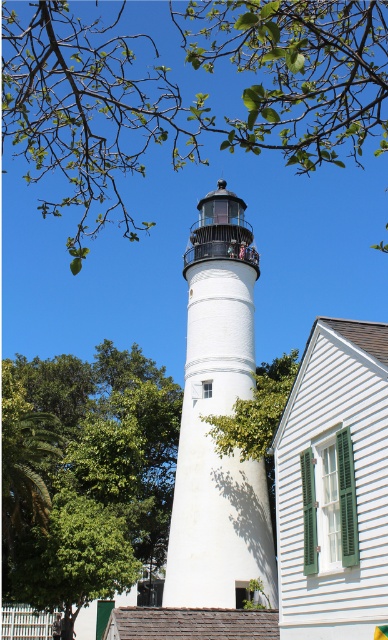
Is green leafy tree at upper center smaller than white matte/lightweight tower at center?

Incorrect, green leafy tree at upper center is not smaller in size than white matte/lightweight tower at center.

Measure the distance between point (136,84) and camera.

Point (136,84) and camera are 120.32 meters apart from each other.

Locate an element on the screen. The width and height of the screenshot is (388, 640). green leafy tree at upper center is located at coordinates (195, 93).

Is green leafy tree at center smaller than white matte/lightweight tower at center?

No, green leafy tree at center is not smaller than white matte/lightweight tower at center.

Between green leafy tree at center and white matte/lightweight tower at center, which one has less height?

With less height is green leafy tree at center.

Where is `green leafy tree at center`? green leafy tree at center is located at coordinates (86, 472).

Who is more distant from viewer, (237,33) or (32,360)?

Positioned behind is point (237,33).

Is green leafy tree at upper center below green leafy tree at center?

No, green leafy tree at upper center is not below green leafy tree at center.

Find the location of a particular element. Image resolution: width=388 pixels, height=640 pixels. green leafy tree at upper center is located at coordinates (195, 93).

The image size is (388, 640). Identify the location of green leafy tree at upper center. (195, 93).